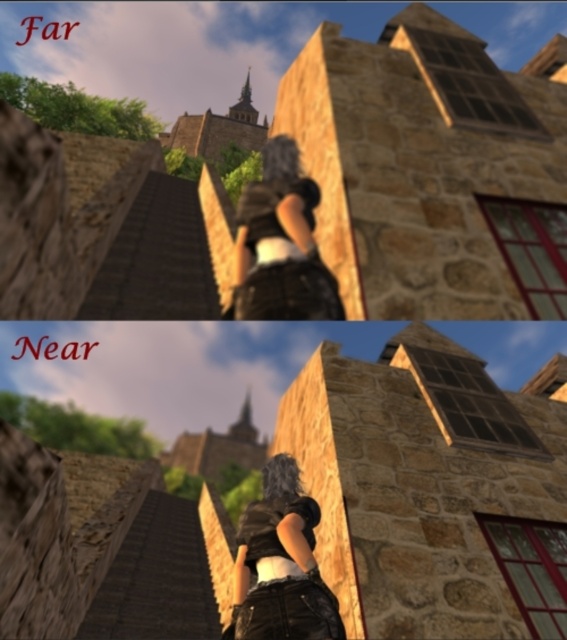
Based on the photo, you are a character in the game who needs to reach the wooden stairs at far left from your current position at the matte black shirt at center. Given that your character can jump a maximum distance of 10 feet, can you reach the stairs in one jump?

The distance between wooden stairs at far left and matte black shirt at center is 11.10 feet, which exceeds your character maximum jump distance of 10 feet. You cannot reach the stairs in one jump.

You are observing the character in the far section of the image. The character is wearing a matte black shirt at center and has matte black hair at center. Which part of the character is located to the left when viewed from your perspective?

The matte black hair at center is located to the left of the matte black shirt at center.